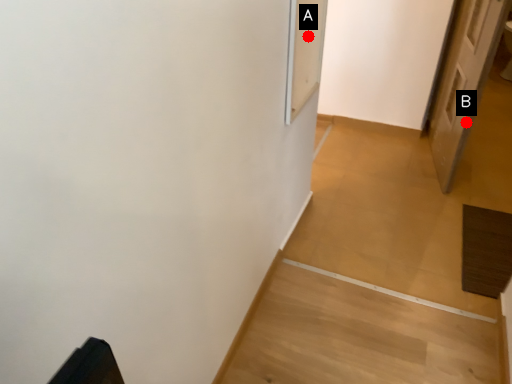
Question: Two points are circled on the image, labeled by A and B beside each circle. Which point is farther to the camera?

Choices:
 (A) A is further
 (B) B is further

Answer: (B)